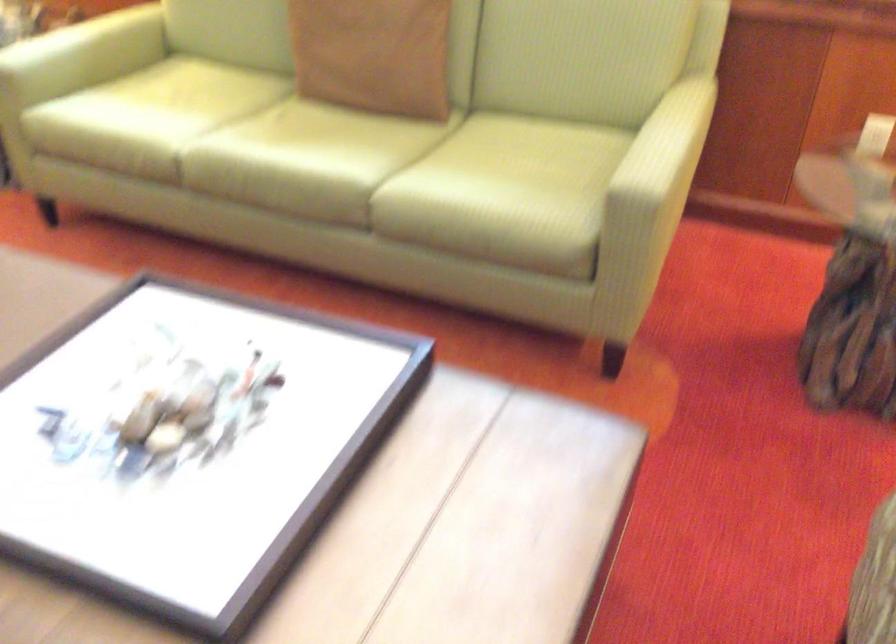
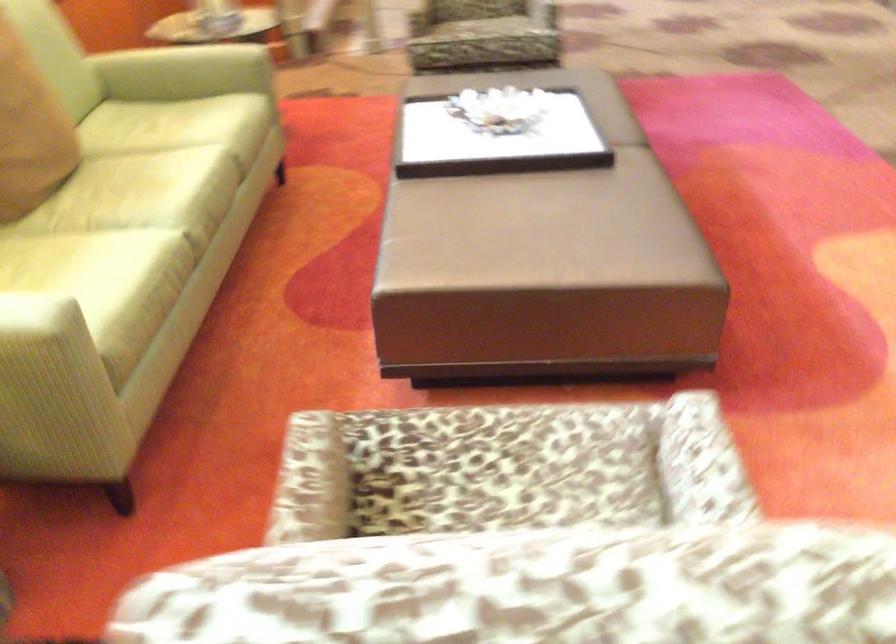
The point at (x=458, y=166) is marked in the first image. Where is the corresponding point in the second image?

(177, 126)